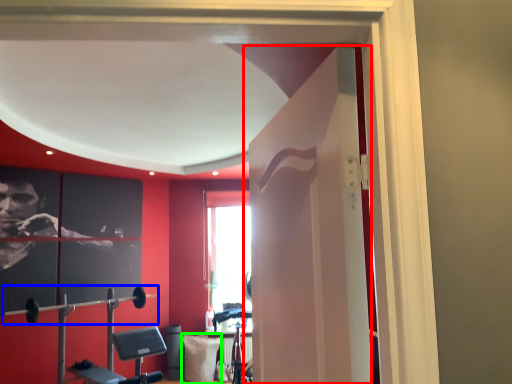
Question: Which object is positioned farthest from door (highlighted by a red box)? Select from barbell (highlighted by a blue box) and pillow (highlighted by a green box).

Choices:
 (A) barbell
 (B) pillow

Answer: (A)